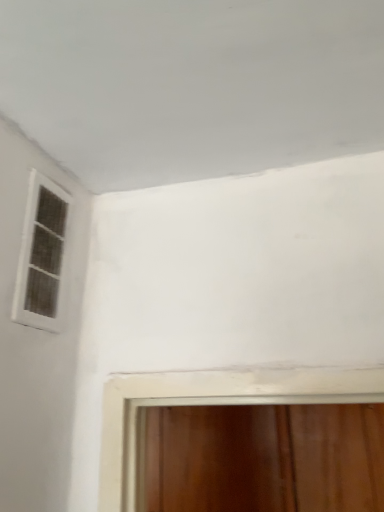
Question: Does transparent glass door at bottom, the first window when ordered from back to front, have a greater width compared to white matte window at upper left, marked as the first window in a top-to-bottom arrangement?

Choices:
 (A) yes
 (B) no

Answer: (A)

Question: Is white matte window at upper left, the 2th window positioned from the right, surrounded by transparent glass door at bottom, the 2th window from the top?

Choices:
 (A) no
 (B) yes

Answer: (A)

Question: From the image's perspective, would you say transparent glass door at bottom, the 2th window from the top, is shown under white matte window at upper left, the 2th window positioned from the right?

Choices:
 (A) no
 (B) yes

Answer: (B)

Question: Is transparent glass door at bottom, the first window positioned from the bottom, to the right of white matte window at upper left, marked as the second window in a back-to-front arrangement, from the viewer's perspective?

Choices:
 (A) no
 (B) yes

Answer: (B)

Question: Considering the relative sizes of transparent glass door at bottom, the 2th window positioned from the front, and white matte window at upper left, the 2th window positioned from the right, in the image provided, is transparent glass door at bottom, the 2th window positioned from the front, thinner than white matte window at upper left, the 2th window positioned from the right,?

Choices:
 (A) no
 (B) yes

Answer: (A)

Question: Is transparent glass door at bottom, the first window when ordered from back to front, oriented towards white matte window at upper left, which appears as the first window when viewed from the left?

Choices:
 (A) no
 (B) yes

Answer: (B)

Question: From the image's perspective, does white matte window at upper left, which appears as the first window when viewed from the left, appear higher than transparent glass door at bottom, the first window positioned from the bottom?

Choices:
 (A) no
 (B) yes

Answer: (B)

Question: Is white matte window at upper left, arranged as the second window when ordered from the bottom, wider than transparent glass door at bottom, the 2th window from the top?

Choices:
 (A) no
 (B) yes

Answer: (A)

Question: Does white matte window at upper left, which appears as the first window when viewed from the left, have a greater height compared to transparent glass door at bottom, the 2th window from the top?

Choices:
 (A) yes
 (B) no

Answer: (B)

Question: Is white matte window at upper left, marked as the first window in a top-to-bottom arrangement, with transparent glass door at bottom, the 2th window positioned from the front?

Choices:
 (A) yes
 (B) no

Answer: (B)

Question: Is white matte window at upper left, marked as the second window in a back-to-front arrangement, oriented away from transparent glass door at bottom, placed as the 2th window when sorted from left to right?

Choices:
 (A) yes
 (B) no

Answer: (B)

Question: From a real-world perspective, is white matte window at upper left, arranged as the second window when ordered from the bottom, under transparent glass door at bottom, placed as the 2th window when sorted from left to right?

Choices:
 (A) yes
 (B) no

Answer: (B)

Question: Is transparent glass door at bottom, the first window when ordered from back to front, inside or outside of white matte window at upper left, marked as the first window in a top-to-bottom arrangement?

Choices:
 (A) outside
 (B) inside

Answer: (A)